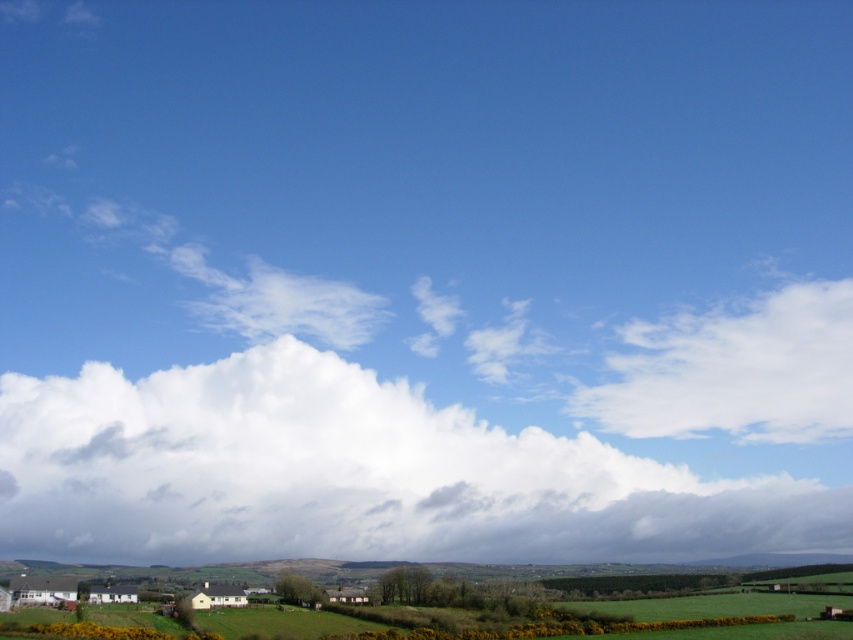
You are an airplane passenger looking out the window and see the white fluffy cloud at center and the white fluffy cloud at upper right. Which one appears bigger in the sky?

The white fluffy cloud at center appears bigger than the white fluffy cloud at upper right because it has a larger size compared to it.

You are an airplane pilot flying at an altitude where you can see the white fluffy cloud at center and the white fluffy cloud at upper right. Which cloud appears wider from your perspective?

The white fluffy cloud at center appears wider than the white fluffy cloud at upper right because its width surpasses the other.